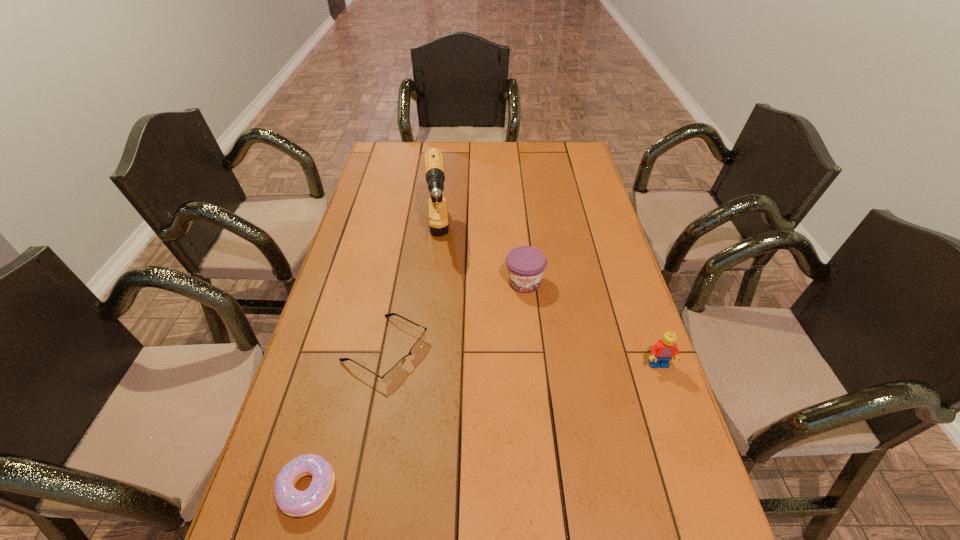
The image size is (960, 540). Find the location of `blank region between the spectacles and the drill`. blank region between the spectacles and the drill is located at coordinates (411, 294).

The width and height of the screenshot is (960, 540). Identify the location of vacant space in between the Lego and the spectacles. (521, 357).

What are the coordinates of `free space that is in between the spectacles and the nearest object` in the screenshot? It's located at (346, 419).

Where is `free space between the Lego and the spectacles`? free space between the Lego and the spectacles is located at coordinates (521, 357).

Where is `blank region between the doughnut and the third tallest object`? The image size is (960, 540). blank region between the doughnut and the third tallest object is located at coordinates (416, 386).

Where is `free space between the Lego and the spectacles`? free space between the Lego and the spectacles is located at coordinates (521, 357).

The image size is (960, 540). I want to click on free space that is in between the fourth object from left to right and the doughnut, so click(x=416, y=386).

Where is `vacant space that is in between the spectacles and the Lego`? This screenshot has width=960, height=540. vacant space that is in between the spectacles and the Lego is located at coordinates (521, 357).

Locate an element on the screen. unoccupied area between the spectacles and the second tallest object is located at coordinates (521, 357).

Identify which object is the nearest to the fourth shortest object. Please provide its 2D coordinates. Your answer should be formatted as a tuple, i.e. [(x, y)], where the tuple contains the x and y coordinates of a point satisfying the conditions above.

[(525, 264)]